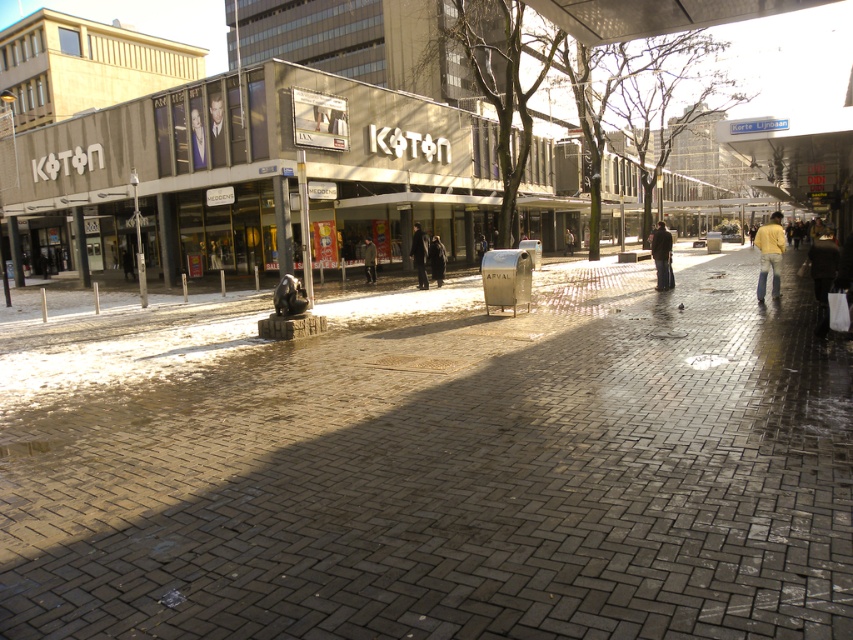
Is point (202, 156) positioned behind point (436, 264)?

Yes, point (202, 156) is behind point (436, 264).

Who is higher up, smooth black suit at upper center or dark brown leather jacket at center?

smooth black suit at upper center is higher up.

Which is in front, point (202, 136) or point (442, 244)?

Point (202, 136) is more forward.

This screenshot has width=853, height=640. What are the coordinates of `smooth black suit at upper center` in the screenshot? It's located at (x=196, y=132).

Which is in front, point (762, 252) or point (666, 240)?

Point (762, 252) is more forward.

Is yellow cotton jacket at right behind dark blue coat at center?

That is False.

Where is `yellow cotton jacket at right`? This screenshot has width=853, height=640. yellow cotton jacket at right is located at coordinates (769, 253).

Can you confirm if brick paved sidewalk at center is positioned above dark brown leather jacket at center?

Actually, brick paved sidewalk at center is below dark brown leather jacket at center.

From the picture: Is brick paved sidewalk at center shorter than dark brown leather jacket at center?

Incorrect, brick paved sidewalk at center's height does not fall short of dark brown leather jacket at center's.

What are the coordinates of `brick paved sidewalk at center` in the screenshot? It's located at (432, 464).

Locate an element on the screen. The image size is (853, 640). brick paved sidewalk at center is located at coordinates (432, 464).